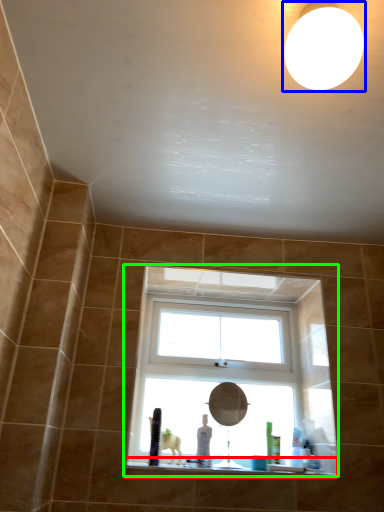
Question: Which object is the farthest from window sill (highlighted by a red box)? Choose among these: lighting (highlighted by a blue box) or window (highlighted by a green box).

Choices:
 (A) lighting
 (B) window

Answer: (A)